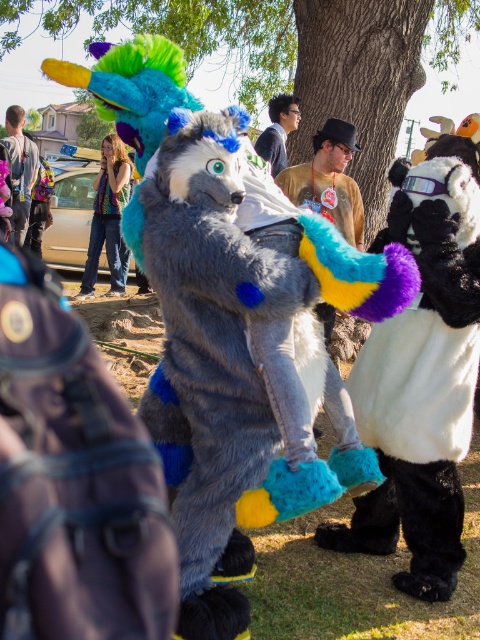
Can you confirm if fluffy fur costume at center is positioned above matte black backpack at left?

No.

Which is in front, point (336, 150) or point (9, 140)?

Point (336, 150) is in front.

Identify the location of fluffy fur costume at center. (328, 180).

Does matte black backpack at left appear under fuzzy gray wolf at center?

No.

Is point (7, 138) more distant than point (278, 141)?

Yes, point (7, 138) is farther from viewer.

This screenshot has height=640, width=480. What are the coordinates of `matte black backpack at left` in the screenshot? It's located at (20, 170).

Between point (470, 387) and point (266, 140), which one is positioned in front?

Point (470, 387)

Is white fluffy costume at right smaller than matte gray fur at center?

No.

Where is `white fluffy costume at right`? Image resolution: width=480 pixels, height=640 pixels. white fluffy costume at right is located at coordinates tap(422, 371).

Identify the location of white fluffy costume at right. This screenshot has height=640, width=480. [x=422, y=371].